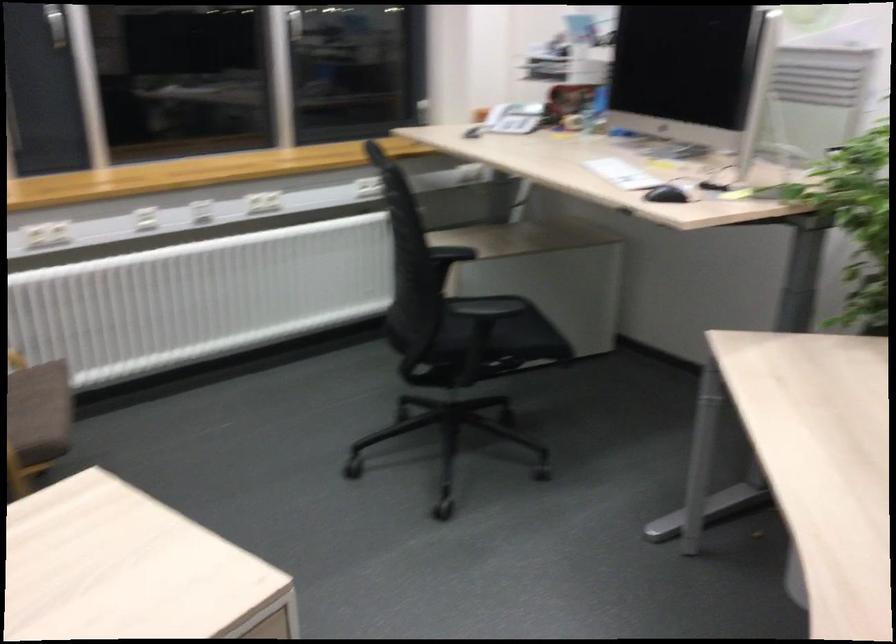
Identify the location of white telephone handset. (496, 115).